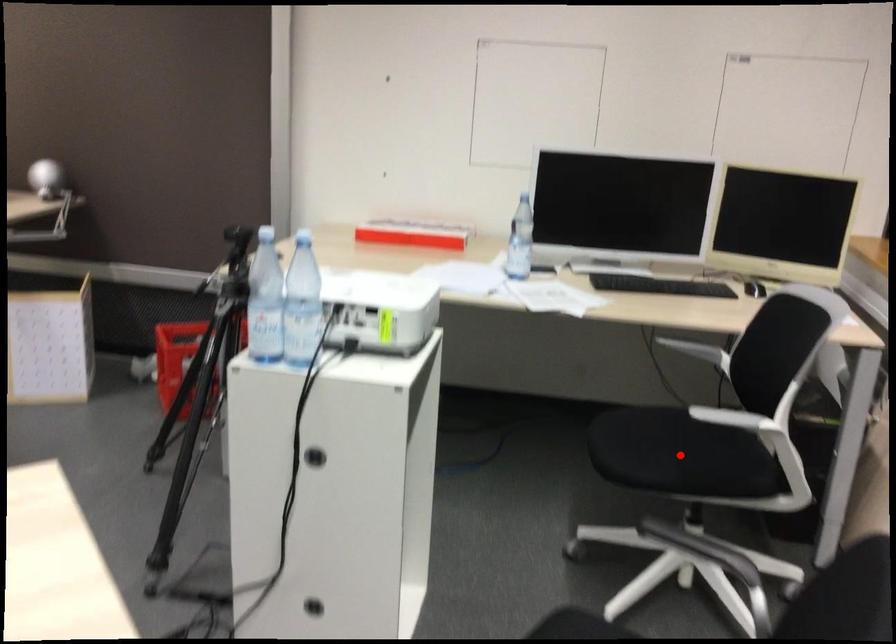
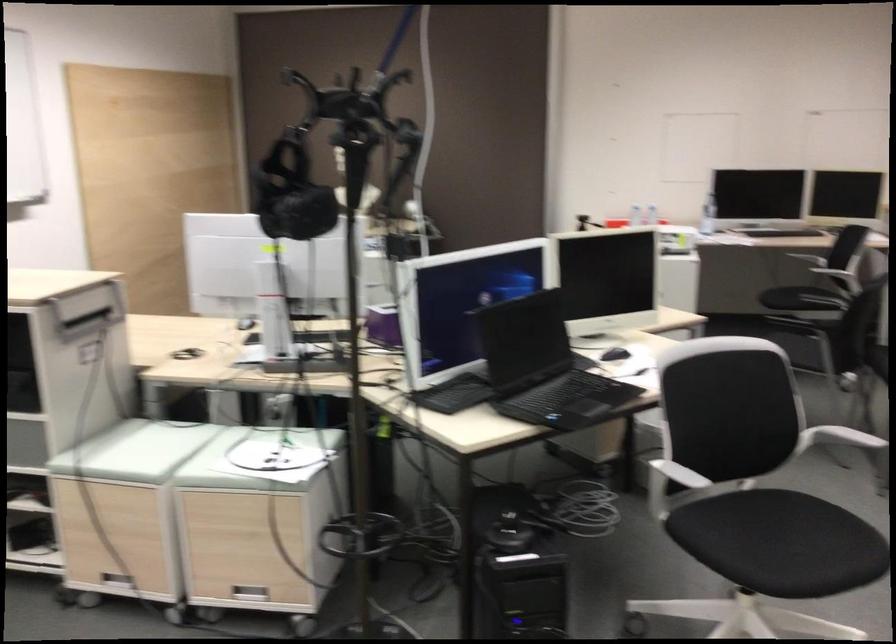
Question: I am providing you with two images of the same scene from different viewpoints. A red point is marked on the first image. At the location where the point appears in image 1, is it still visible in image 2?

Choices:
 (A) Yes
 (B) No

Answer: (B)